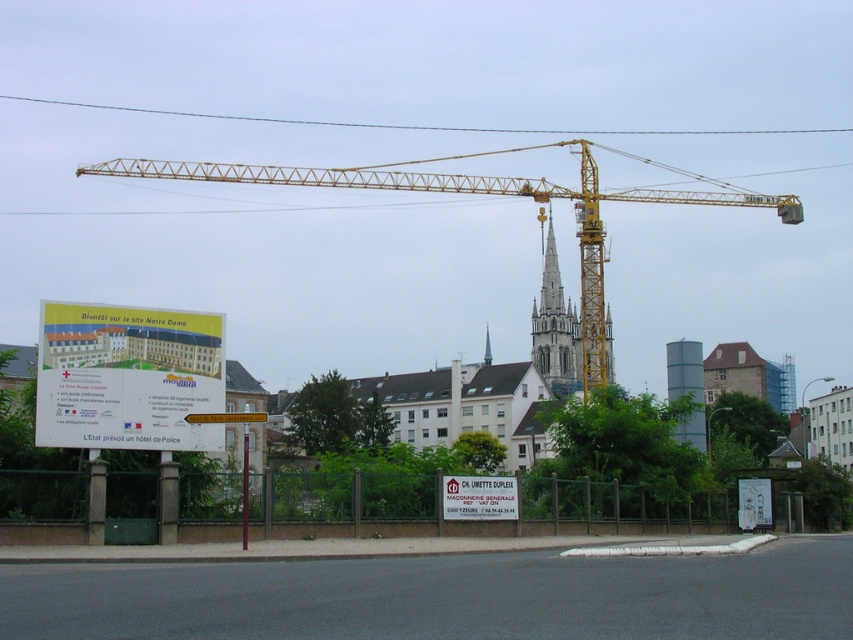
Based on the photo, between polished stone spire at center and white plastic street sign at center, which one is positioned lower?

Positioned lower is polished stone spire at center.

Find the location of a particular element. This screenshot has height=640, width=853. polished stone spire at center is located at coordinates (555, 328).

Locate an element on the screen. polished stone spire at center is located at coordinates (555, 328).

Which is below, white plastic street sign at center or smooth gray steeple at center?

smooth gray steeple at center is below.

The height and width of the screenshot is (640, 853). I want to click on white plastic street sign at center, so click(x=225, y=417).

Which is in front, point (204, 413) or point (486, 349)?

Point (204, 413) is more forward.

Find the location of a particular element. white plastic street sign at center is located at coordinates (225, 417).

Who is lower down, yellow metallic crane at upper center or polished stone spire at center?

polished stone spire at center

Where is `yellow metallic crane at upper center`? The height and width of the screenshot is (640, 853). yellow metallic crane at upper center is located at coordinates (486, 195).